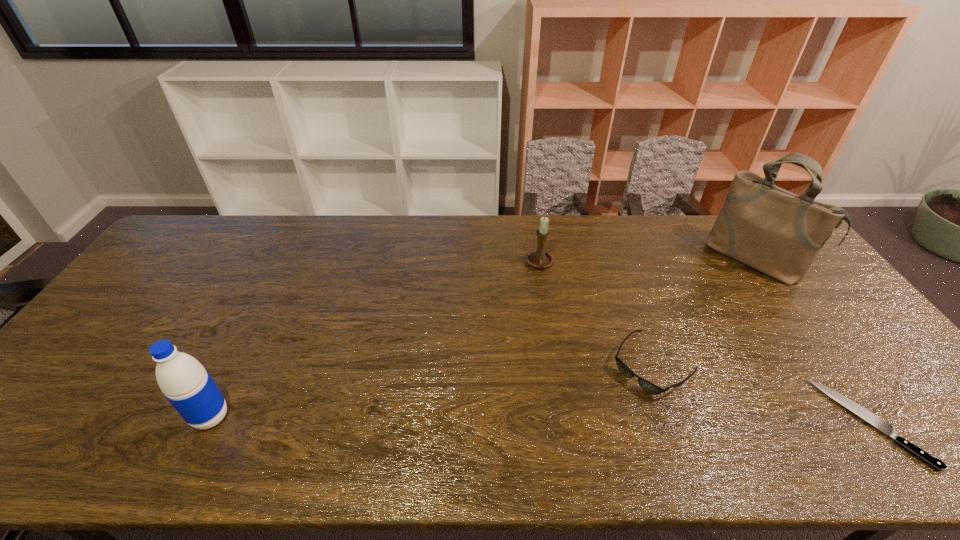
At what (x,y) coordinates should I click in order to perform the action: click on water bottle located in the near edge section of the desktop. Please return your answer as a coordinate pair (x, y). Looking at the image, I should click on pos(187,385).

The width and height of the screenshot is (960, 540). I want to click on steak knife that is positioned at the near edge, so click(x=887, y=428).

Image resolution: width=960 pixels, height=540 pixels. I want to click on sunglasses present at the near edge, so click(649, 387).

Where is `steak knife that is at the right edge`? steak knife that is at the right edge is located at coordinates (887, 428).

The image size is (960, 540). I want to click on shoulder bag at the right edge, so click(x=779, y=233).

In order to click on object present at the far right corner in this screenshot , I will do `click(779, 233)`.

Locate an element on the screen. Image resolution: width=960 pixels, height=540 pixels. object that is at the near right corner is located at coordinates (887, 428).

The height and width of the screenshot is (540, 960). I want to click on free region at the far edge of the desktop, so click(x=621, y=235).

Locate an element on the screen. Image resolution: width=960 pixels, height=540 pixels. free space at the near edge of the desktop is located at coordinates (467, 420).

You are a GUI agent. You are given a task and a screenshot of the screen. Output one action in this format:
    pyautogui.click(x=<x>, y=<y>)
    Task: Click on the free spot at the left edge of the desktop
    
    Given the screenshot: What is the action you would take?
    pyautogui.click(x=82, y=364)